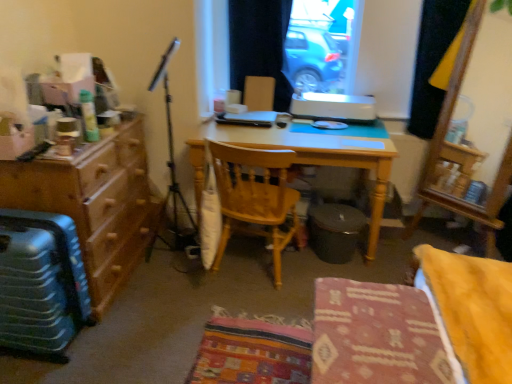
Question: Does light wood desk at center have a lesser width compared to black fabric curtain at upper center, which is the first curtain in left-to-right order?

Choices:
 (A) no
 (B) yes

Answer: (A)

Question: Considering the relative positions of light wood desk at center and black fabric curtain at upper center, which is the first curtain in left-to-right order, in the image provided, is light wood desk at center behind black fabric curtain at upper center, which is the first curtain in left-to-right order,?

Choices:
 (A) yes
 (B) no

Answer: (B)

Question: Is light wood desk at center to the left of black fabric curtain at upper center, which is the first curtain in left-to-right order, from the viewer's perspective?

Choices:
 (A) yes
 (B) no

Answer: (B)

Question: Is light wood desk at center in front of black fabric curtain at upper center, the second curtain positioned from the right?

Choices:
 (A) no
 (B) yes

Answer: (B)

Question: Considering the relative sizes of light wood desk at center and black fabric curtain at upper center, which is the first curtain in left-to-right order, in the image provided, is light wood desk at center smaller than black fabric curtain at upper center, which is the first curtain in left-to-right order,?

Choices:
 (A) yes
 (B) no

Answer: (B)

Question: From the image's perspective, is patterned fabric chair at center, arranged as the 1th chair when viewed from the front, above or below black fabric curtain at upper center, which is the first curtain in left-to-right order?

Choices:
 (A) above
 (B) below

Answer: (B)

Question: Does point (442, 273) appear closer or farther from the camera than point (271, 11)?

Choices:
 (A) closer
 (B) farther

Answer: (A)

Question: From a real-world perspective, relative to black fabric curtain at upper center, which is the first curtain in left-to-right order, is patterned fabric chair at center, arranged as the 1th chair when viewed from the front, vertically above or below?

Choices:
 (A) below
 (B) above

Answer: (A)

Question: From their relative heights in the image, would you say patterned fabric chair at center, marked as the 2th chair in a back-to-front arrangement, is taller or shorter than black fabric curtain at upper center, the second curtain positioned from the right?

Choices:
 (A) tall
 (B) short

Answer: (B)

Question: Considering the relative positions of light wood desk at center and black fabric curtain at upper center, which is the first curtain in left-to-right order, in the image provided, is light wood desk at center to the left or to the right of black fabric curtain at upper center, which is the first curtain in left-to-right order,?

Choices:
 (A) right
 (B) left

Answer: (A)

Question: Which is correct: light wood desk at center is inside black fabric curtain at upper center, which is the first curtain in left-to-right order, or outside of it?

Choices:
 (A) outside
 (B) inside

Answer: (A)

Question: Considering the positions of light wood desk at center and black fabric curtain at upper center, the second curtain positioned from the right, in the image, is light wood desk at center wider or thinner than black fabric curtain at upper center, the second curtain positioned from the right,?

Choices:
 (A) wide
 (B) thin

Answer: (A)

Question: From a real-world perspective, relative to black fabric curtain at upper center, which is the first curtain in left-to-right order, is light wood desk at center vertically above or below?

Choices:
 (A) below
 (B) above

Answer: (A)

Question: Looking at their shapes, would you say metallic suitcase at lower left is wider or thinner than wooden chair at center, marked as the 2th chair in a front-to-back arrangement?

Choices:
 (A) thin
 (B) wide

Answer: (A)

Question: Considering the positions of point (46, 263) and point (272, 188), is point (46, 263) closer or farther from the camera than point (272, 188)?

Choices:
 (A) farther
 (B) closer

Answer: (B)